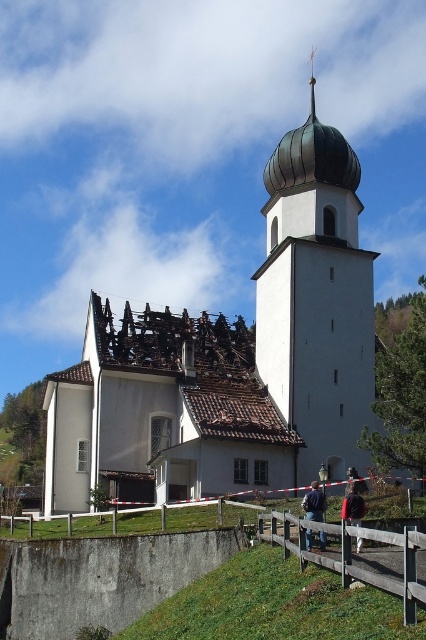
Locate an element on the screen. The height and width of the screenshot is (640, 426). green copper dome at center is located at coordinates (316, 298).

The height and width of the screenshot is (640, 426). Describe the element at coordinates (316, 298) in the screenshot. I see `green copper dome at center` at that location.

This screenshot has height=640, width=426. I want to click on green copper dome at center, so click(316, 298).

At what (x,y) coordinates should I click in order to perform the action: click on green copper dome at center. Please return your answer as a coordinate pair (x, y). The height and width of the screenshot is (640, 426). Looking at the image, I should click on (316, 298).

In the scene shown: Can you confirm if white stucco church at center is shorter than dark brown leather jacket at center?

Incorrect, white stucco church at center's height does not fall short of dark brown leather jacket at center's.

Between point (305, 419) and point (348, 516), which one is positioned in front?

Point (348, 516)

Does point (78, 456) come behind point (354, 484)?

That is True.

At what (x,y) coordinates should I click in order to perform the action: click on white stucco church at center. Please return your answer as a coordinate pair (x, y). The width and height of the screenshot is (426, 640). Looking at the image, I should click on (233, 360).

Is point (302, 522) positioned behind point (307, 513)?

No, (302, 522) is in front of (307, 513).

Describe the element at coordinates (353, 557) in the screenshot. I see `wooden at lower center` at that location.

The height and width of the screenshot is (640, 426). In order to click on wooden at lower center in this screenshot , I will do `click(353, 557)`.